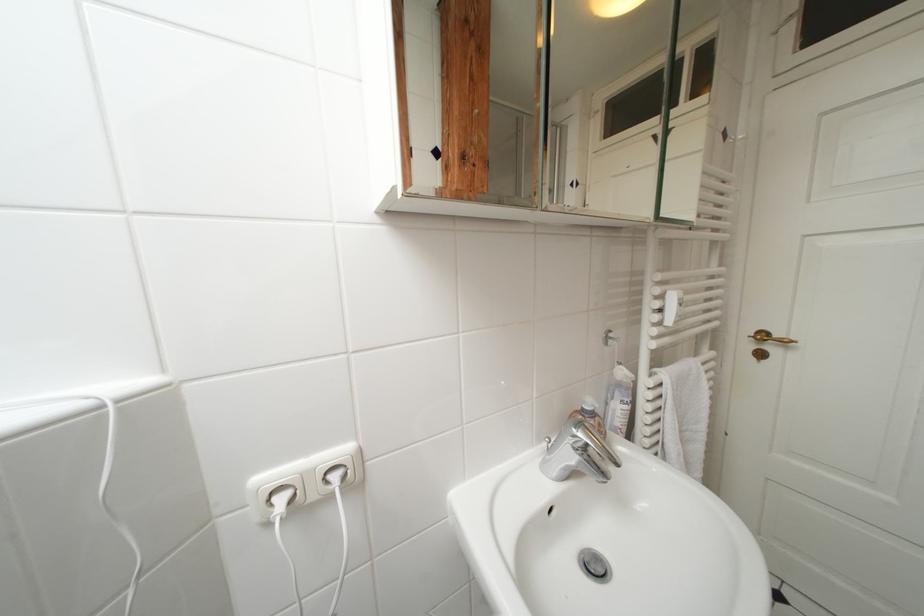
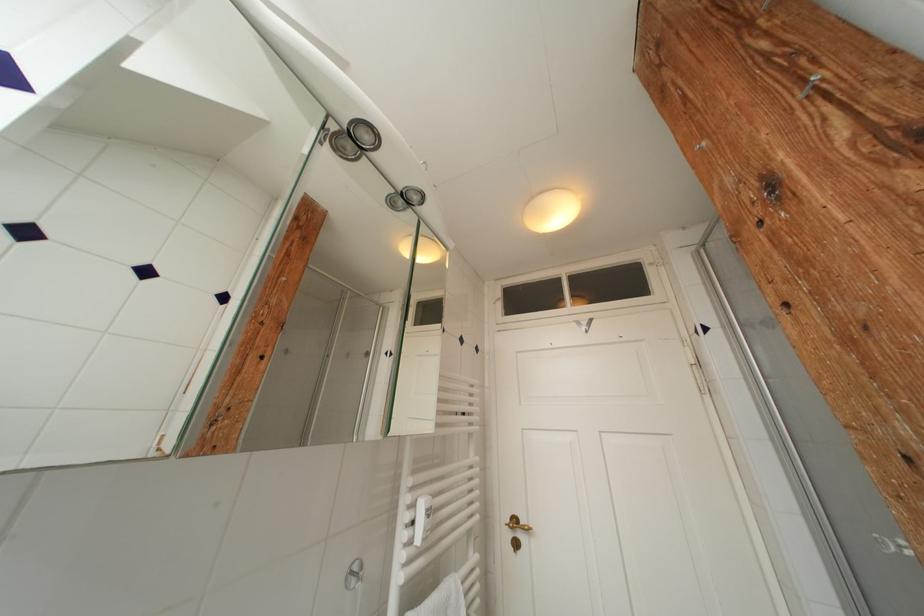
Where in the second image is the point corresponding to [723,235] from the first image?

(478, 427)